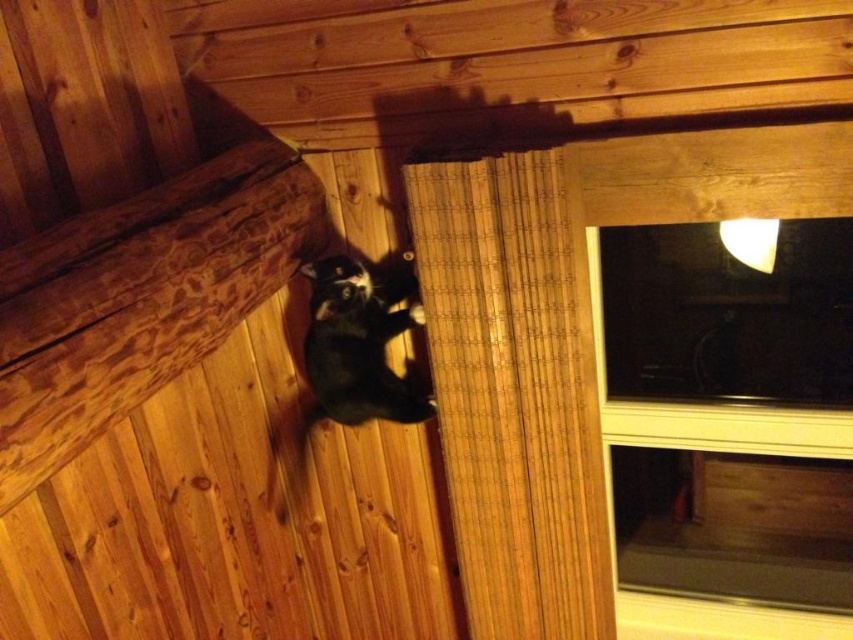
You are a visitor in this room and want to know if the bamboo curtain at upper center can completely cover the black fur cat at center if it were to fall down. Based on their sizes, what do you think?

The bamboo curtain at upper center is larger in size than the black fur cat at center, so it could potentially cover the cat if it were to fall down.